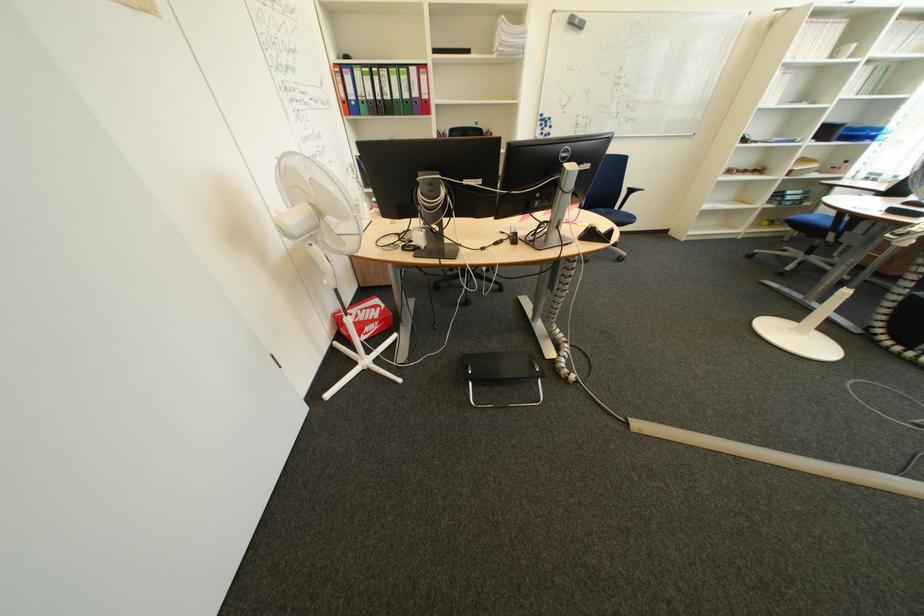
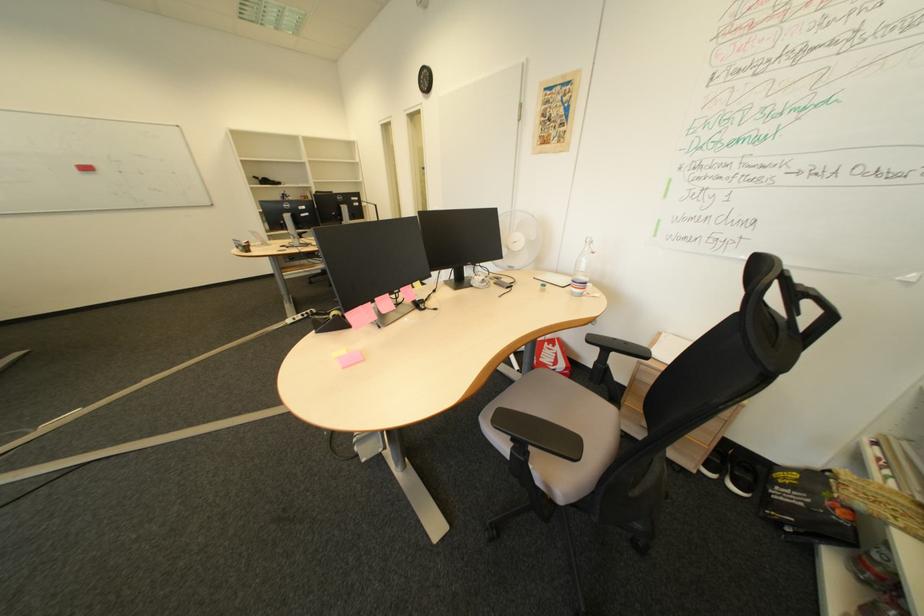
Locate, in the second image, the point that corresponds to the point at 373,321 in the first image.

(556, 351)